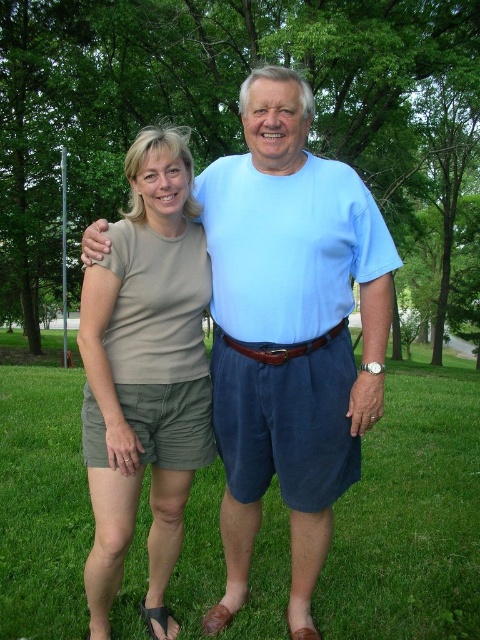
You are planning to set up a small picnic blanket between the green grass at center and the matte khaki shorts at left. Based on their widths, which area would be more suitable for placing the blanket?

The green grass at center has a greater width than the matte khaki shorts at left, making it more suitable for placing the picnic blanket due to its wider space.